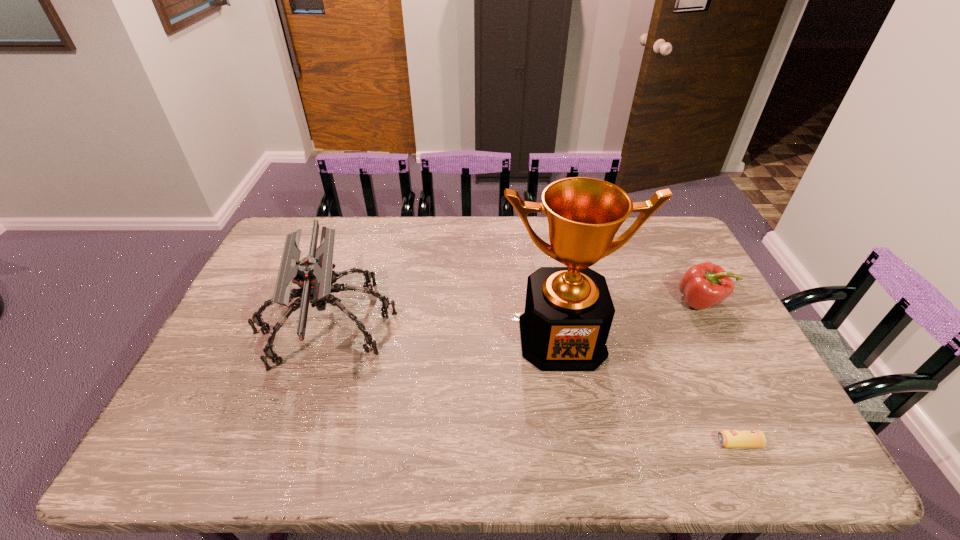
Identify which object is the second nearest to the third tallest object. Please provide its 2D coordinates. Your answer should be formatted as a tuple, i.e. [(x, y)], where the tuple contains the x and y coordinates of a point satisfying the conditions above.

[(727, 438)]

Select which object appears as the third closest to the shortest object. Please provide its 2D coordinates. Your answer should be formatted as a tuple, i.e. [(x, y)], where the tuple contains the x and y coordinates of a point satisfying the conditions above.

[(313, 274)]

This screenshot has height=540, width=960. I want to click on vacant space that satisfies the following two spatial constraints: 1. on the front side of the leftmost object; 2. on the right side of the nearest object, so click(285, 443).

Where is `vacant space that satisfies the following two spatial constraints: 1. on the front side of the shortest object; 2. on the left side of the second tallest object`? The width and height of the screenshot is (960, 540). vacant space that satisfies the following two spatial constraints: 1. on the front side of the shortest object; 2. on the left side of the second tallest object is located at coordinates (285, 443).

At what (x,y) coordinates should I click in order to perform the action: click on free location that satisfies the following two spatial constraints: 1. on the front of the trophy cup with the label; 2. on the left side of the beer can. Please return your answer as a coordinate pair (x, y). This screenshot has height=540, width=960. Looking at the image, I should click on (581, 443).

The width and height of the screenshot is (960, 540). I want to click on free region that satisfies the following two spatial constraints: 1. on the front of the second object from left to right with the label; 2. on the right side of the nearest object, so click(581, 443).

Where is `vacant space that satisfies the following two spatial constraints: 1. on the front of the tallest object with the label; 2. on the left side of the beer can`? The width and height of the screenshot is (960, 540). vacant space that satisfies the following two spatial constraints: 1. on the front of the tallest object with the label; 2. on the left side of the beer can is located at coordinates (581, 443).